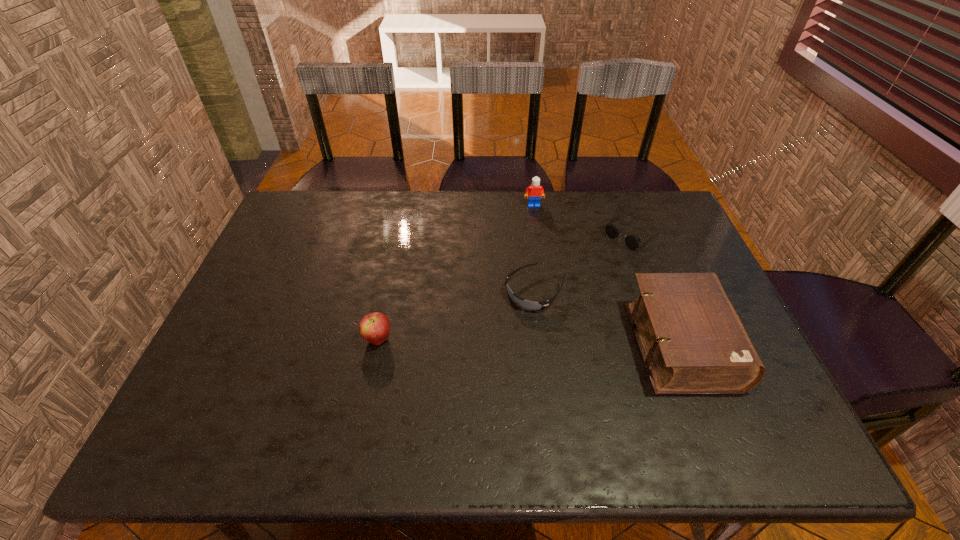
The height and width of the screenshot is (540, 960). Find the location of `the leftmost object`. the leftmost object is located at coordinates (375, 328).

Image resolution: width=960 pixels, height=540 pixels. I want to click on Bible, so click(x=692, y=341).

I want to click on Lego, so click(x=535, y=191).

What are the coordinates of `the second farthest object` in the screenshot? It's located at (632, 241).

Where is `the right sunglasses`? The image size is (960, 540). the right sunglasses is located at coordinates (632, 241).

At what (x,y) coordinates should I click in order to perform the action: click on the nearer sunglasses. Please return your answer as a coordinate pair (x, y). This screenshot has height=540, width=960. Looking at the image, I should click on (528, 305).

I want to click on free space located on the back of the leftmost object, so click(389, 283).

Image resolution: width=960 pixels, height=540 pixels. In order to click on free space located on the spine side of the Bible in this screenshot , I will do `click(748, 345)`.

Identify the location of free spot located 0.210m on the face of the farthest object. The image size is (960, 540). (542, 248).

Locate an element on the screen. This screenshot has height=540, width=960. free space located 0.180m on the face of the farthest object is located at coordinates [540, 242].